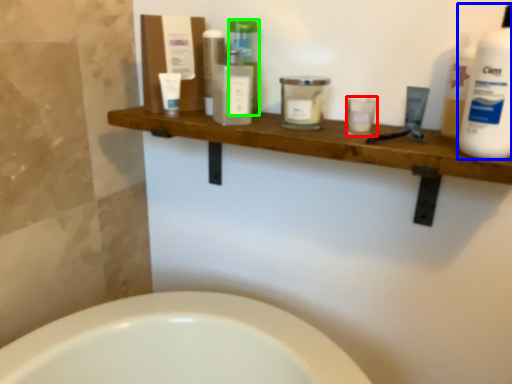
Question: Which is farther away from toiletry (highlighted by a red box)? cleaning product (highlighted by a blue box) or toiletry (highlighted by a green box)?

Choices:
 (A) cleaning product
 (B) toiletry

Answer: (B)